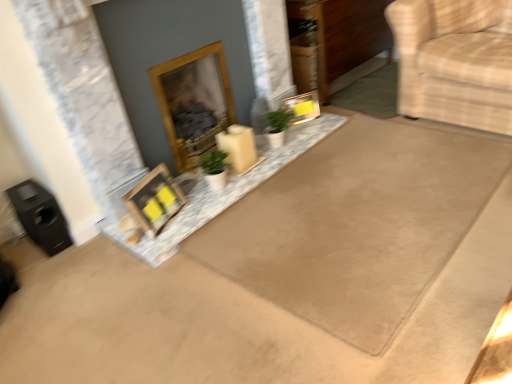
Question: Is beige carpet at upper right, which is the 2th doormat in left-to-right order, oriented away from beige fabric armchair at right?

Choices:
 (A) no
 (B) yes

Answer: (A)

Question: Considering the relative sizes of beige carpet at upper right, which is the 2th doormat in left-to-right order, and beige fabric armchair at right in the image provided, is beige carpet at upper right, which is the 2th doormat in left-to-right order, taller than beige fabric armchair at right?

Choices:
 (A) yes
 (B) no

Answer: (B)

Question: From a real-world perspective, is beige carpet at upper right, which is the 2th doormat in left-to-right order, below beige fabric armchair at right?

Choices:
 (A) yes
 (B) no

Answer: (A)

Question: Does beige carpet at upper right, which is the 2th doormat in left-to-right order, touch beige fabric armchair at right?

Choices:
 (A) no
 (B) yes

Answer: (A)

Question: Is beige carpet at upper right, which is the 2th doormat in left-to-right order, not inside beige fabric armchair at right?

Choices:
 (A) no
 (B) yes

Answer: (B)

Question: From the image's perspective, relative to matte gold picture frame at center, which is the 1th picture frame in top-to-bottom order, is wooden picture frame at center, which appears as the second picture frame when viewed from the top, above or below?

Choices:
 (A) below
 (B) above

Answer: (A)

Question: In the image, is wooden picture frame at center, which is the 1th picture frame in bottom-to-top order, positioned in front of or behind matte gold picture frame at center, which is the second picture frame from left to right?

Choices:
 (A) front
 (B) behind

Answer: (A)

Question: From a real-world perspective, relative to matte gold picture frame at center, which is the 1th picture frame in top-to-bottom order, is wooden picture frame at center, which appears as the second picture frame when viewed from the top, vertically above or below?

Choices:
 (A) above
 (B) below

Answer: (A)

Question: Looking at the image, does wooden picture frame at center, which is the 1th picture frame in bottom-to-top order, seem bigger or smaller compared to matte gold picture frame at center, the 1th picture frame when ordered from right to left?

Choices:
 (A) small
 (B) big

Answer: (B)

Question: Does point (194, 147) appear closer or farther from the camera than point (308, 97)?

Choices:
 (A) farther
 (B) closer

Answer: (B)

Question: In the image, is wooden fireplace at center positioned in front of or behind matte gold picture frame at center, the 2th picture frame positioned from the front?

Choices:
 (A) front
 (B) behind

Answer: (A)

Question: Do you think wooden fireplace at center is within matte gold picture frame at center, which ranks as the 2th picture frame in bottom-to-top order, or outside of it?

Choices:
 (A) inside
 (B) outside

Answer: (B)

Question: From a real-world perspective, relative to matte gold picture frame at center, which is the 1th picture frame in top-to-bottom order, is wooden fireplace at center vertically above or below?

Choices:
 (A) below
 (B) above

Answer: (B)

Question: Relative to wooden picture frame at center, which appears as the 1th picture frame when viewed from the left, is wooden fireplace at center in front or behind?

Choices:
 (A) front
 (B) behind

Answer: (B)

Question: Considering the relative positions of wooden fireplace at center and wooden picture frame at center, which is the second picture frame in back-to-front order, in the image provided, is wooden fireplace at center to the left or to the right of wooden picture frame at center, which is the second picture frame in back-to-front order,?

Choices:
 (A) left
 (B) right

Answer: (B)